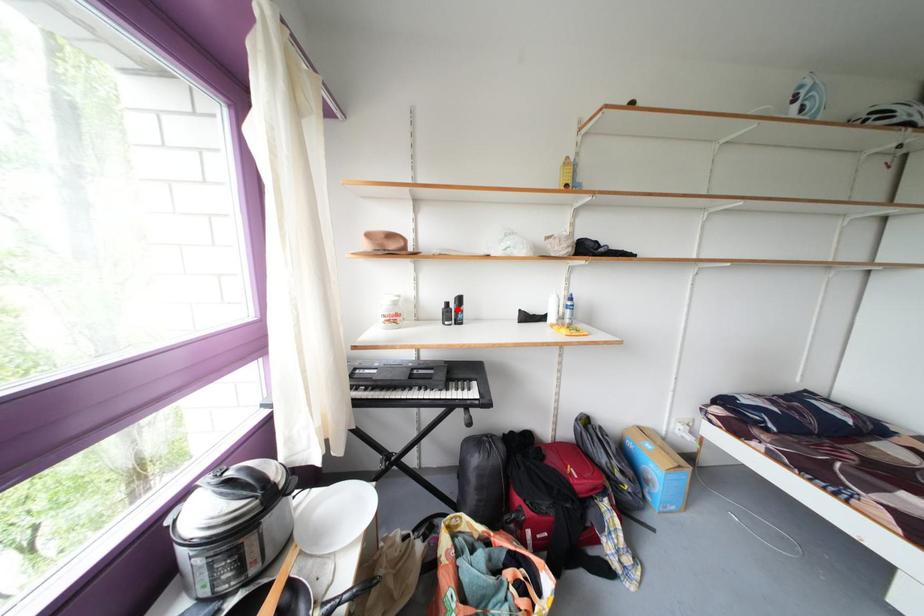
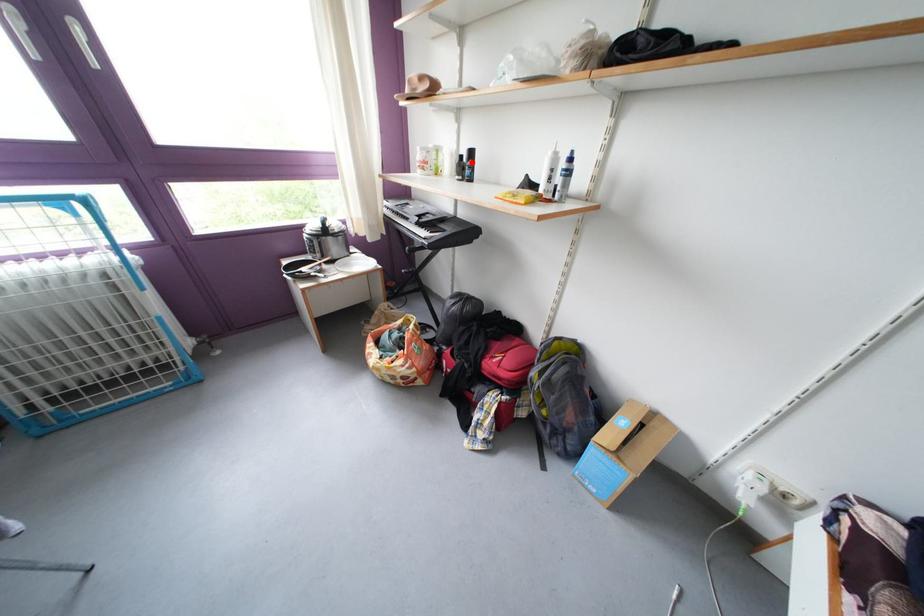
I am providing you with two images of the same scene from different viewpoints. A red point is marked on the first image and another point is marked on the second image. Do the highlighted points in image1 and image2 indicate the same real-world spot?

Yes